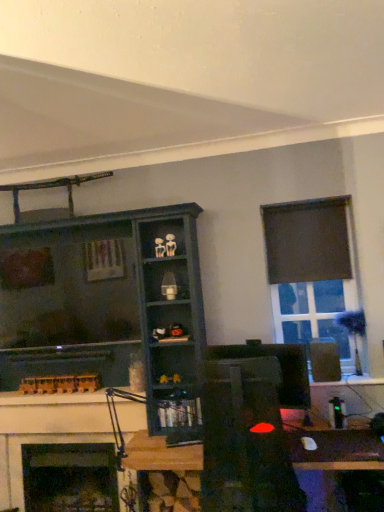
Question: Based on their sizes in the image, would you say dark matte window at upper right is bigger or smaller than dark wood shelf at center, marked as the first shelf in a top-to-bottom arrangement?

Choices:
 (A) small
 (B) big

Answer: (A)

Question: Is dark matte window at upper right in front of or behind dark wood shelf at center, positioned as the second shelf in bottom-to-top order, in the image?

Choices:
 (A) behind
 (B) front

Answer: (A)

Question: Considering the real-world distances, which object is closest to the black fabric curtain at upper right?

Choices:
 (A) dark wood shelf at center, positioned as the second shelf in bottom-to-top order
 (B) dark matte window at upper right
 (C) white painted wood fireplace at lower left
 (D) wooden desk at center
 (E) black plastic speaker at right

Answer: (B)

Question: Which object is the closest to the metallic silver shelf at center, which is the 2th shelf in left-to-right order?

Choices:
 (A) matte black monitor at center
 (B) dark wood shelf at center, which is the first shelf in left-to-right order
 (C) white painted wood fireplace at lower left
 (D) black plastic speaker at right
 (E) dark matte window at upper right

Answer: (B)